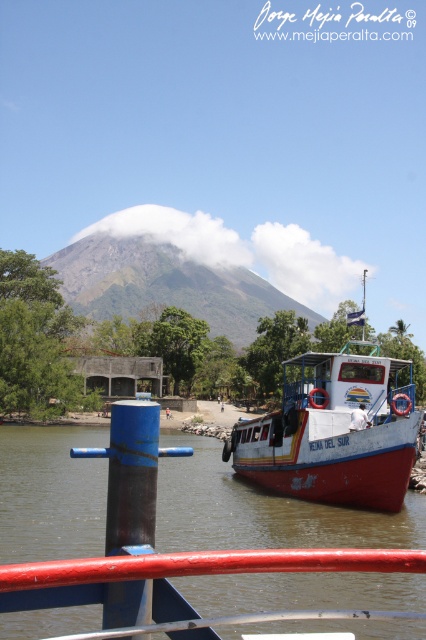
Is white matte boat at center in front of red painted metal railing at lower center?

No, white matte boat at center is behind red painted metal railing at lower center.

Who is positioned more to the right, white matte boat at center or red painted metal railing at lower center?

white matte boat at center

Who is more forward, (x=317, y=464) or (x=115, y=636)?

Point (x=115, y=636) is more forward.

At what (x,y) coordinates should I click in order to perform the action: click on white matte boat at center. Please return your answer as a coordinate pair (x, y). Looking at the image, I should click on (333, 433).

Who is higher up, white matte boat at center or blue metallic pole at center?

Positioned higher is blue metallic pole at center.

Can you confirm if white matte boat at center is positioned below blue metallic pole at center?

Yes.

Who is more forward, (368, 388) or (123, 499)?

Point (123, 499) is in front.

Locate an element on the screen. white matte boat at center is located at coordinates (333, 433).

Which is behind, point (72, 550) or point (26, 582)?

The point (72, 550) is behind.

Is point (265, 604) farther from camera compared to point (158, 627)?

Yes.

In order to click on brown water at lower left in this screenshot , I will do pyautogui.click(x=261, y=509).

The image size is (426, 640). I want to click on brown water at lower left, so click(x=261, y=509).